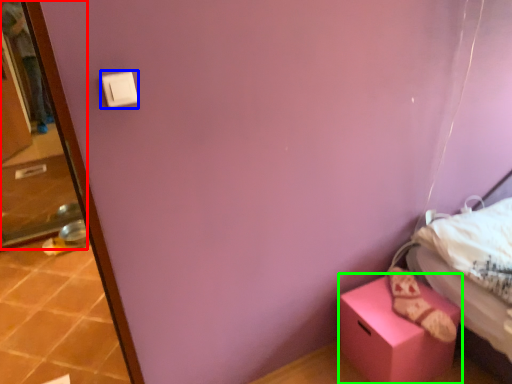
Question: Which object is the closest to the screen door (highlighted by a red box)? Choose among these: light switch (highlighted by a blue box) or box (highlighted by a green box).

Choices:
 (A) light switch
 (B) box

Answer: (B)